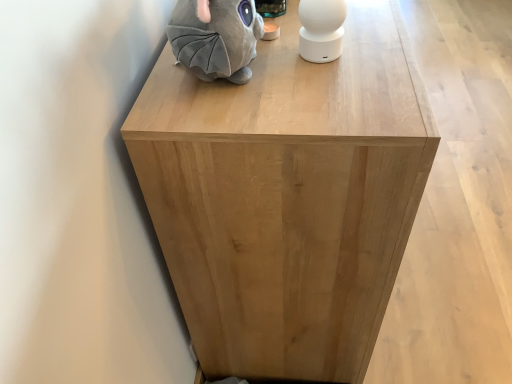
The width and height of the screenshot is (512, 384). Find the location of `free space in front of white matte speaker at upper center, which is counted as the first toy, starting from the right`. free space in front of white matte speaker at upper center, which is counted as the first toy, starting from the right is located at coordinates (339, 99).